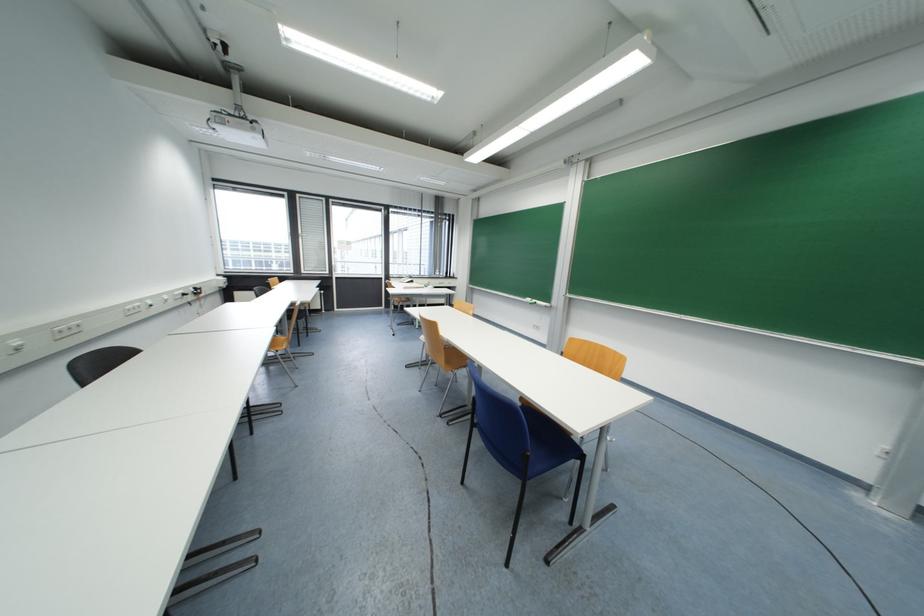
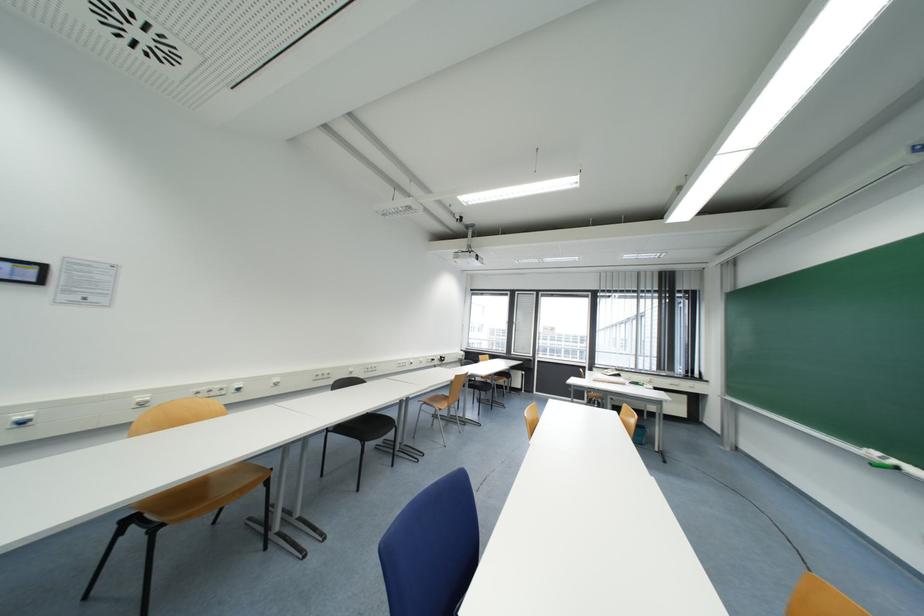
Find the pixel in the second image that matches [539,302] in the first image.

(898, 464)